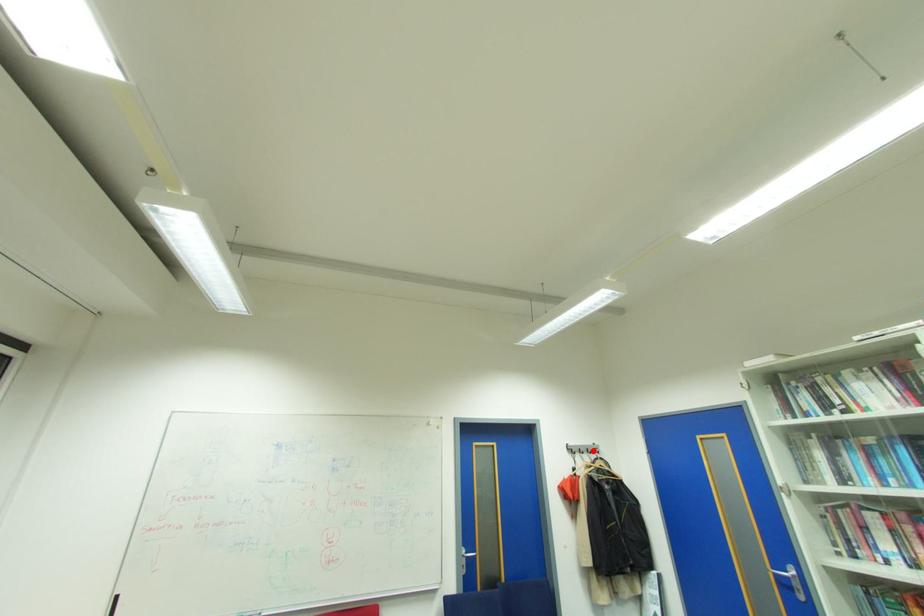
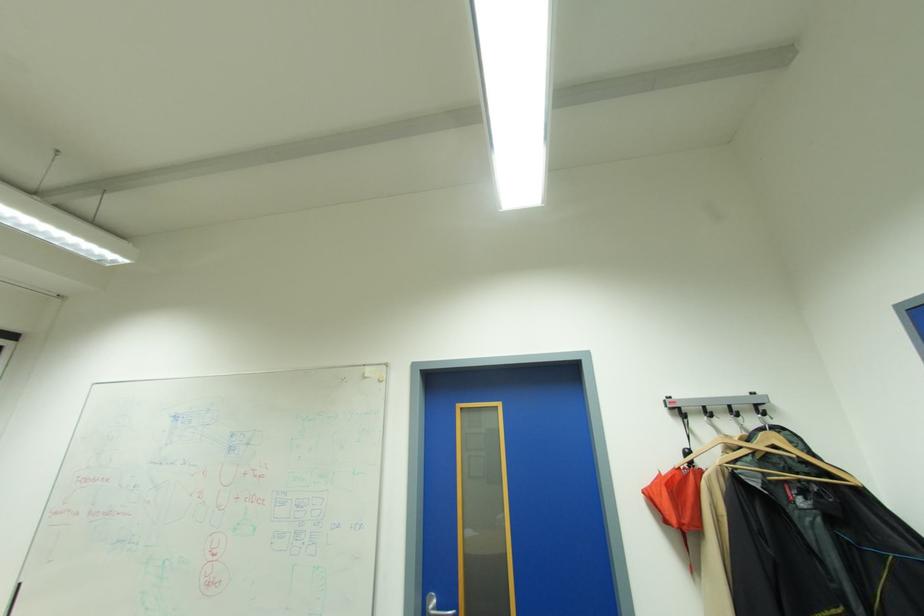
The point at the highlighted location is marked in the first image. Where is the corresponding point in the second image?

(738, 410)